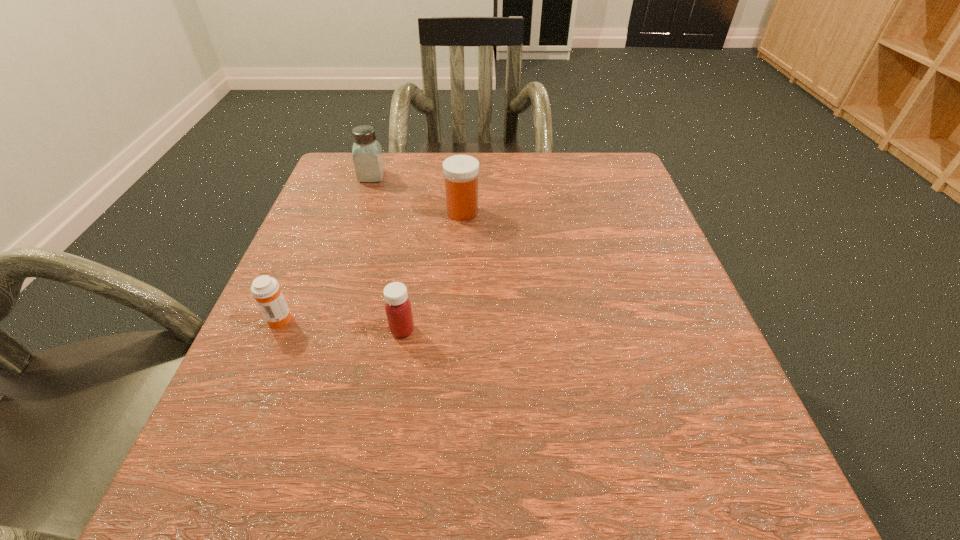
At what (x,y) coordinates should I click in order to perform the action: click on saltshaker. Please return your answer as a coordinate pair (x, y). Looking at the image, I should click on (368, 160).

At what (x,y) coordinates should I click in order to perform the action: click on the third object from right to left. Please return your answer as a coordinate pair (x, y). Looking at the image, I should click on (368, 160).

Find the location of a particular element. the rightmost medicine is located at coordinates (461, 172).

Where is `the rightmost object`? This screenshot has height=540, width=960. the rightmost object is located at coordinates (461, 172).

Where is `the second medicine from left to right`? the second medicine from left to right is located at coordinates (398, 309).

At what (x,y) coordinates should I click in order to perform the action: click on the leftmost medicine. Please return your answer as a coordinate pair (x, y). This screenshot has height=540, width=960. Looking at the image, I should click on (265, 289).

Identify the location of free space located on the right of the farthest object. The width and height of the screenshot is (960, 540). (527, 176).

Locate an element on the screen. The height and width of the screenshot is (540, 960). vacant space located on the left of the second farthest object is located at coordinates (351, 212).

The height and width of the screenshot is (540, 960). Find the location of `vacant position located 0.280m on the back of the second medicine from right to left`. vacant position located 0.280m on the back of the second medicine from right to left is located at coordinates (420, 218).

Where is `vacant space situated on the front of the leftmost object`? vacant space situated on the front of the leftmost object is located at coordinates (263, 355).